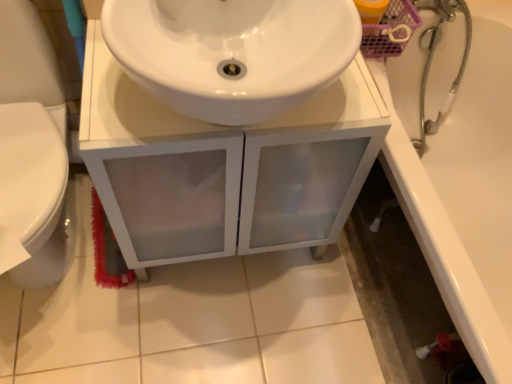
What is the approximate height of white frosted glass cabinet at center?

The height of white frosted glass cabinet at center is 26.62 inches.

At what (x,y) coordinates should I click in order to perform the action: click on white frosted glass cabinet at center. Please return your answer as a coordinate pair (x, y). This screenshot has width=512, height=384. Looking at the image, I should click on (224, 167).

This screenshot has width=512, height=384. What do you see at coordinates (224, 167) in the screenshot? I see `white frosted glass cabinet at center` at bounding box center [224, 167].

This screenshot has width=512, height=384. What are the coordinates of `white frosted glass cabinet at center` in the screenshot? It's located at (224, 167).